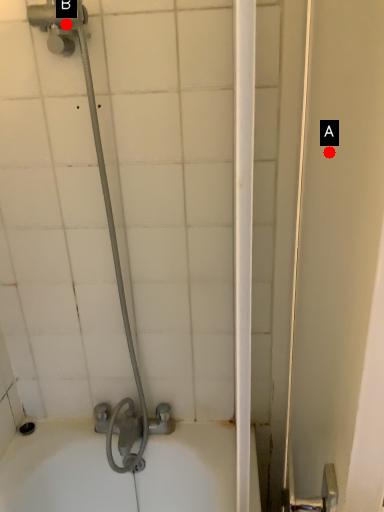
Question: Two points are circled on the image, labeled by A and B beside each circle. Which point appears closest to the camera in this image?

Choices:
 (A) A is closer
 (B) B is closer

Answer: (A)